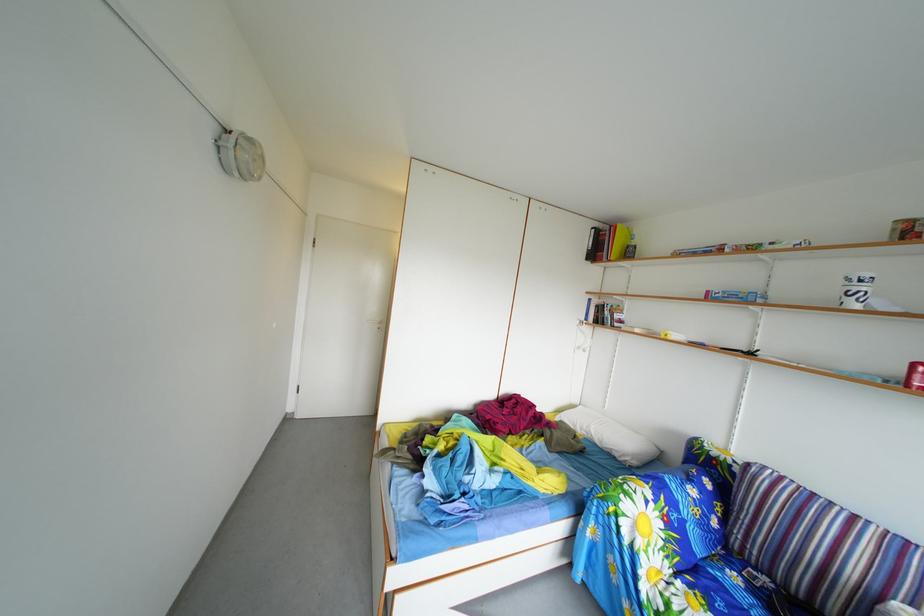
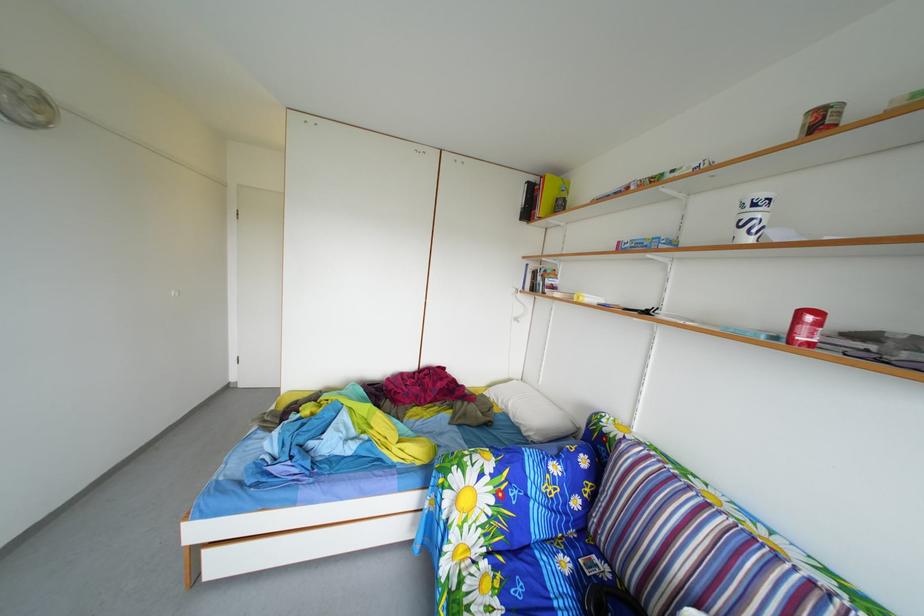
The point at (254,164) is marked in the first image. Where is the corresponding point in the second image?

(14, 105)